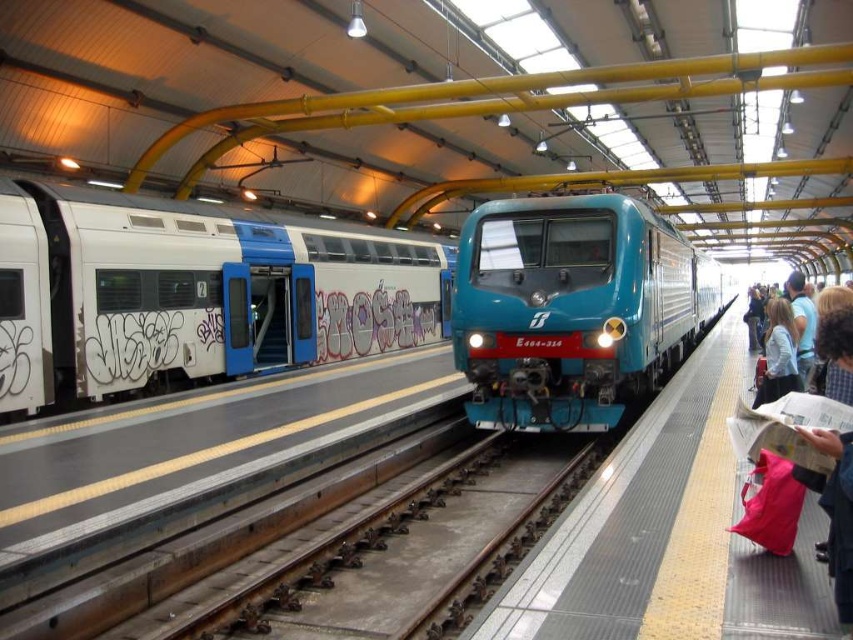
Question: Can you confirm if white matte train at left is bigger than light brown hair at right?

Choices:
 (A) yes
 (B) no

Answer: (B)

Question: Which object is positioned farthest from the white matte train at left?

Choices:
 (A) light blue fabric jacket at right
 (B) light brown hair at right

Answer: (B)

Question: Is light blue fabric jacket at right above light brown hair at right?

Choices:
 (A) yes
 (B) no

Answer: (B)

Question: Among these objects, which one is farthest from the camera?

Choices:
 (A) light brown hair at right
 (B) light blue fabric jacket at right
 (C) white matte train at left
 (D) teal glossy train at center

Answer: (C)

Question: Is teal glossy train at center smaller than light blue fabric jacket at right?

Choices:
 (A) yes
 (B) no

Answer: (B)

Question: Which object appears farthest from the camera in this image?

Choices:
 (A) white matte train at left
 (B) teal glossy train at center
 (C) light blue fabric jacket at right

Answer: (A)